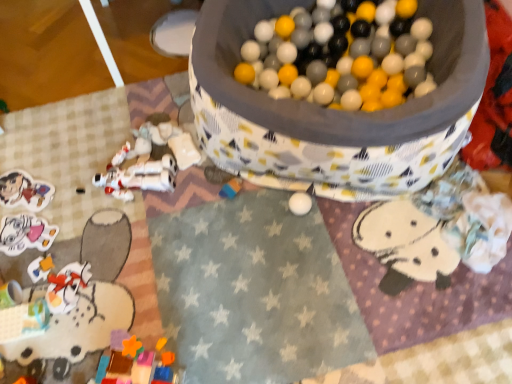
Find the location of a particular element. The height and width of the screenshot is (384, 512). free point behind matte cardboard sticker at lower left, which is the sixth toy from right to left is located at coordinates (39, 152).